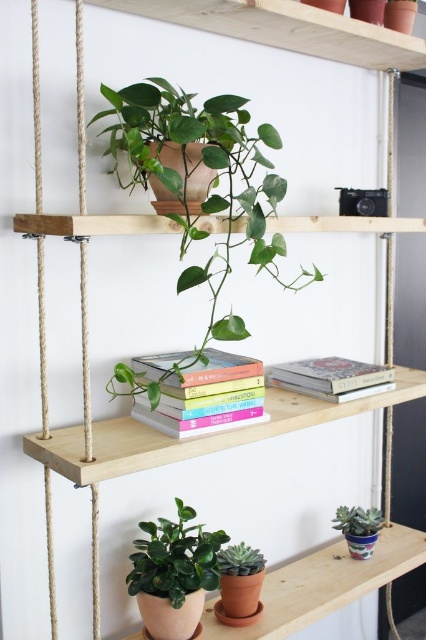
Question: Is hardcover books at center closer to camera compared to hardcover book at center?

Choices:
 (A) no
 (B) yes

Answer: (B)

Question: Is green matte plant at center above hardcover book at center?

Choices:
 (A) no
 (B) yes

Answer: (B)

Question: Among these objects, which one is nearest to the camera?

Choices:
 (A) green matte succulent at lower right
 (B) hardcover book at center
 (C) green matte succulent at lower center

Answer: (C)

Question: Which is farther from the green matte succulent at lower center?

Choices:
 (A) hardcover book at center
 (B) green matte succulent at lower right

Answer: (A)

Question: Among these points, which one is farthest from the camera?

Choices:
 (A) (247, 566)
 (B) (354, 536)

Answer: (B)

Question: Can you confirm if green matte plant at lower center is thinner than green matte succulent at lower right?

Choices:
 (A) no
 (B) yes

Answer: (A)